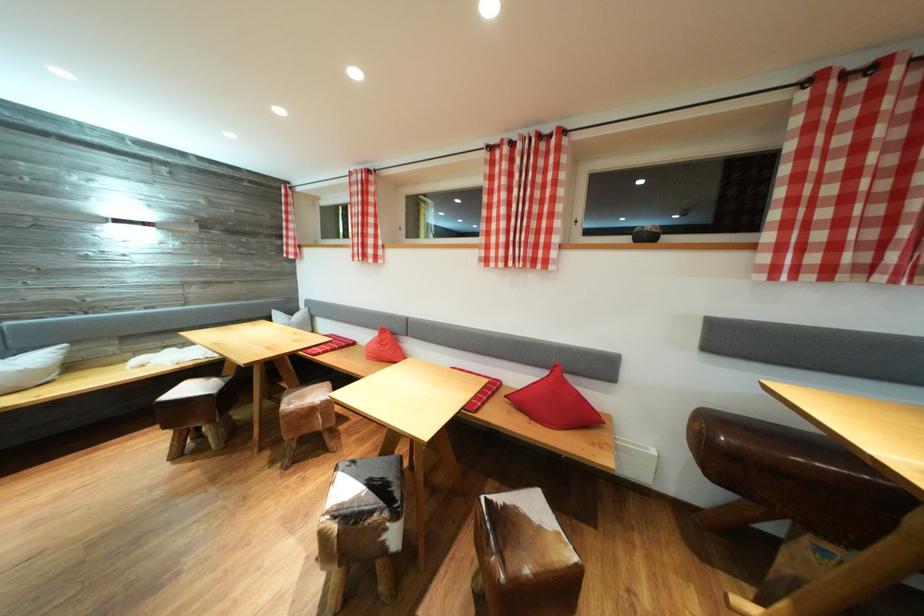
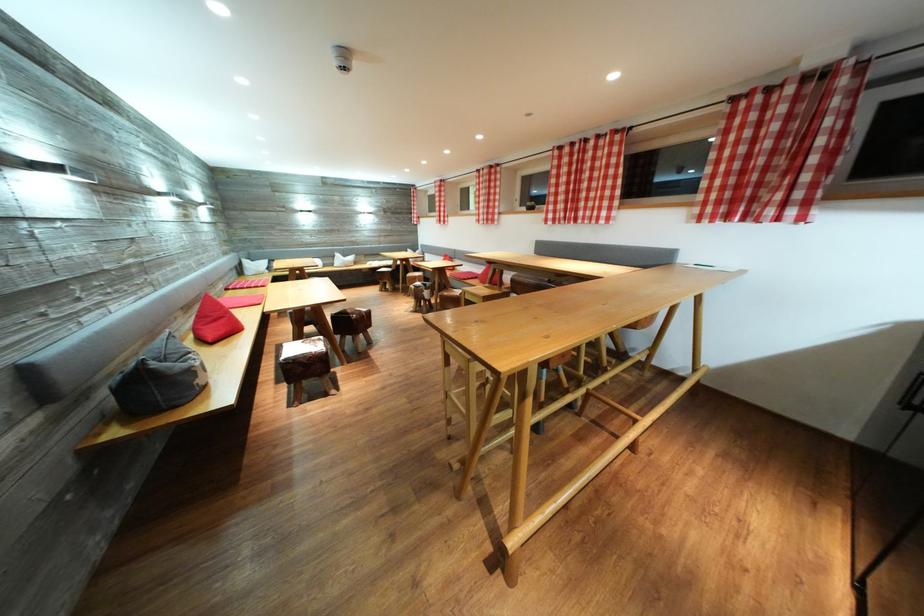
Where in the second image is the point corresponding to the point at 203,434 from the first image?

(393, 289)